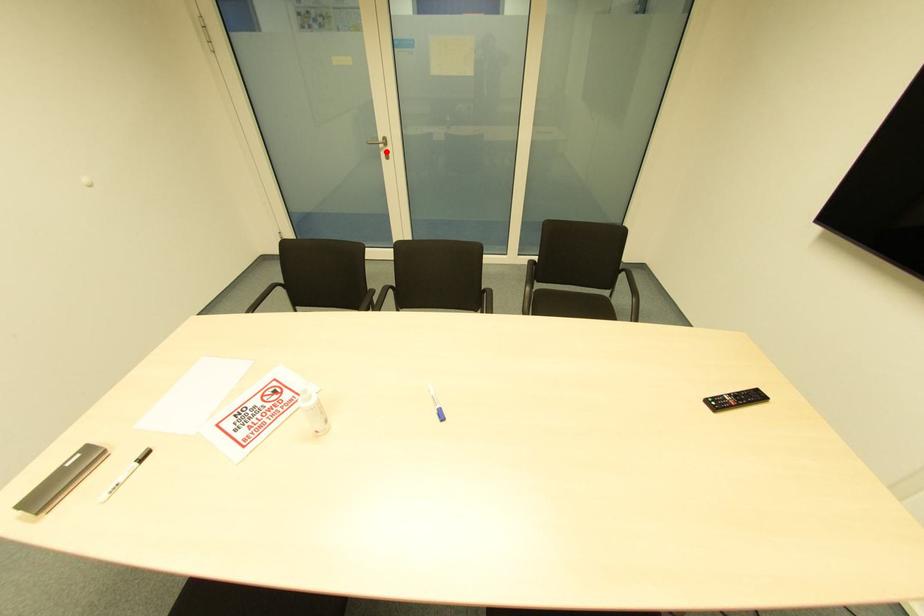
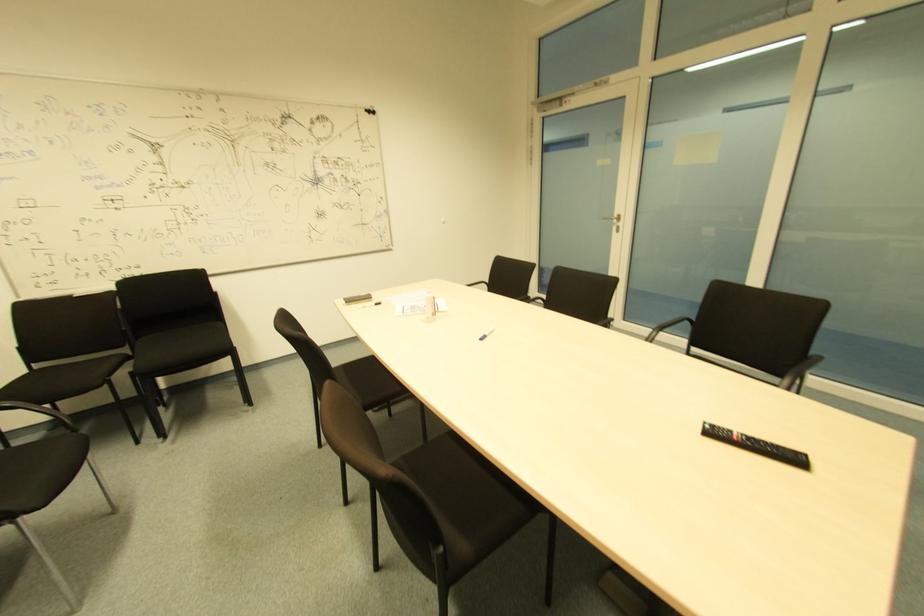
Find the pixel in the second image that matches the highlighted location in the first image.

(618, 227)